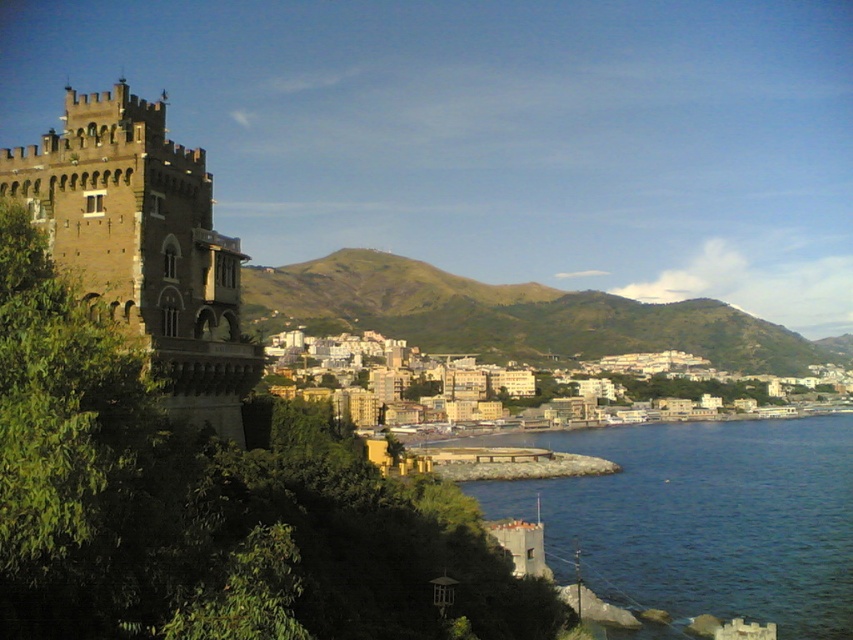
Does blue liquid water at lower right appear on the right side of brown stone tower at left?

Indeed, blue liquid water at lower right is positioned on the right side of brown stone tower at left.

Does point (621, 468) come farther from viewer compared to point (181, 381)?

Yes.

Identify the location of blue liquid water at lower right. (701, 518).

Is point (55, 161) closer to camera compared to point (732, 352)?

Yes, point (55, 161) is closer to viewer.

Which is in front, point (86, 173) or point (721, 337)?

Point (86, 173) is more forward.

What are the coordinates of `brown stone tower at left` in the screenshot? It's located at (143, 243).

Does blue liquid water at lower right have a lesser height compared to beige concrete buildings at center?

Yes, blue liquid water at lower right is shorter than beige concrete buildings at center.

Between point (728, 570) and point (670, 356), which one is positioned behind?

Point (670, 356)

At what (x,y) coordinates should I click in order to perform the action: click on blue liquid water at lower right. Please return your answer as a coordinate pair (x, y). Image resolution: width=853 pixels, height=640 pixels. Looking at the image, I should click on (701, 518).